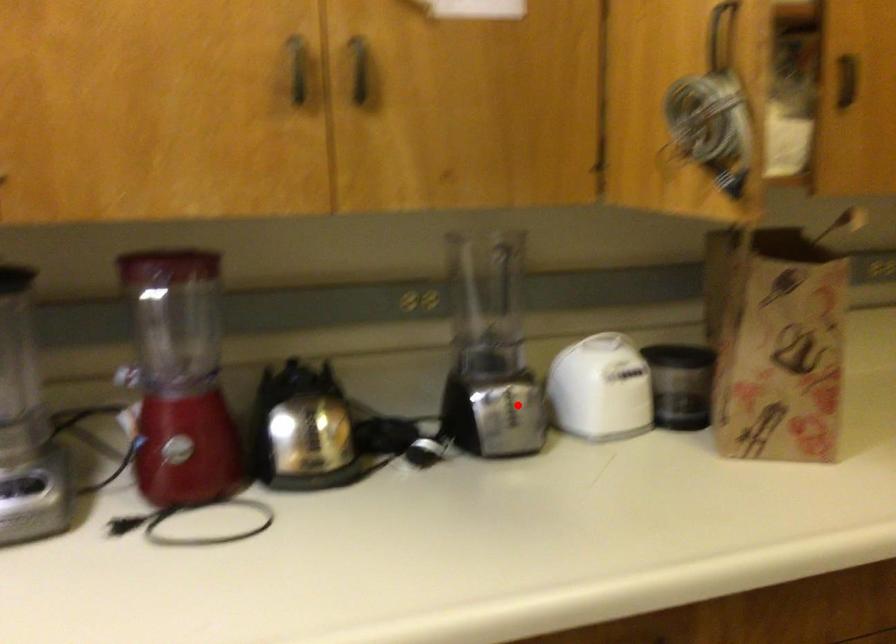
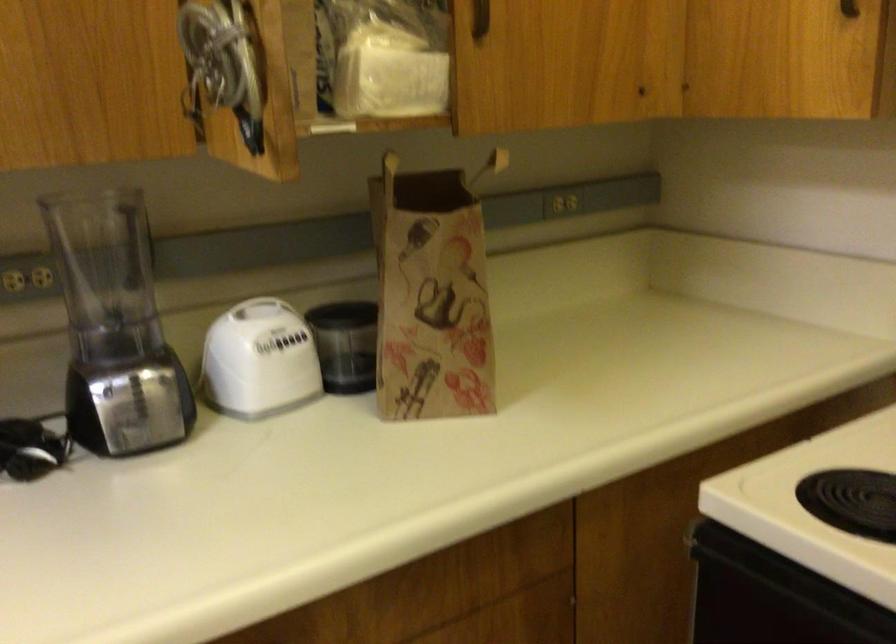
Question: I am providing you with two images of the same scene from different viewpoints. A red point is marked on the first image. Is the red point's position out of view in image 2?

Choices:
 (A) Yes
 (B) No

Answer: (B)